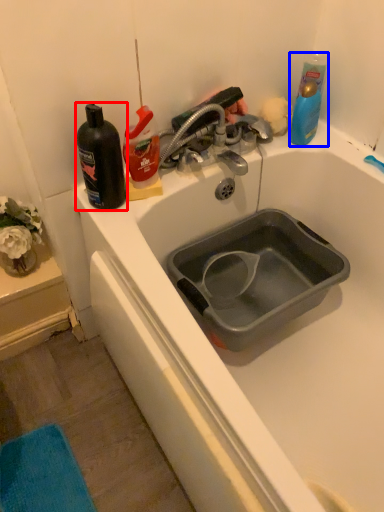
Question: Which object appears farthest to the camera in this image, mouthwash (highlighted by a red box) or cleaning product (highlighted by a blue box)?

Choices:
 (A) mouthwash
 (B) cleaning product

Answer: (B)